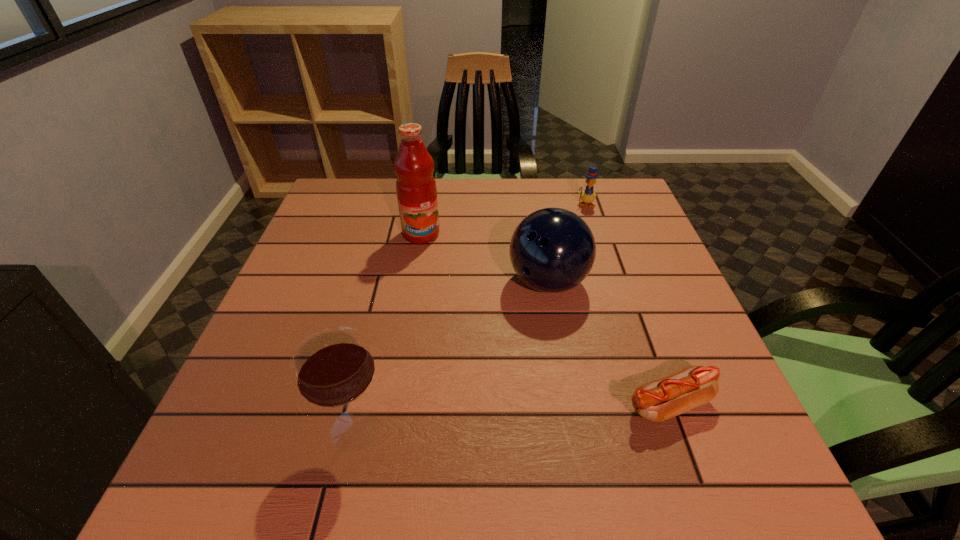
I want to click on duckling that is at the far edge, so click(x=588, y=196).

Identify the location of wineglass that is at the near edge. This screenshot has height=540, width=960. (333, 367).

Identify the location of sausage that is positioned at the near edge. Image resolution: width=960 pixels, height=540 pixels. (659, 400).

The width and height of the screenshot is (960, 540). I want to click on sausage situated at the right edge, so click(x=659, y=400).

The width and height of the screenshot is (960, 540). What are the coordinates of `duckling at the right edge` in the screenshot? It's located at (588, 196).

The width and height of the screenshot is (960, 540). Find the location of `object at the far right corner`. object at the far right corner is located at coordinates (588, 196).

The height and width of the screenshot is (540, 960). What are the coordinates of `object at the near right corner` in the screenshot? It's located at (659, 400).

What are the coordinates of `vacant area at the far edge` in the screenshot? It's located at point(484,215).

At what (x,y) coordinates should I click in order to perform the action: click on vacant space at the near edge of the desktop. Please return your answer as a coordinate pair (x, y). Looking at the image, I should click on (615, 432).

Identify the location of vacant area at the left edge of the desktop. The image size is (960, 540). (305, 266).